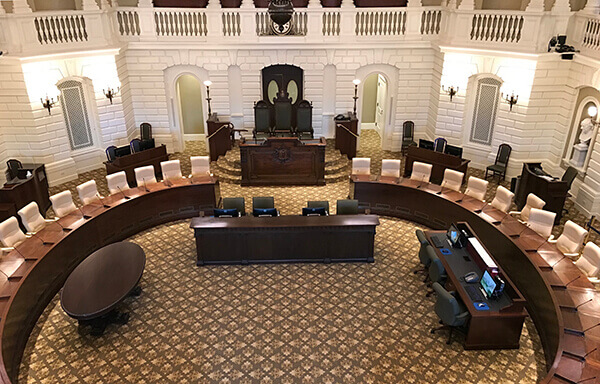
Locate an element on the screen. The height and width of the screenshot is (384, 600). tile ground is located at coordinates (281, 336).